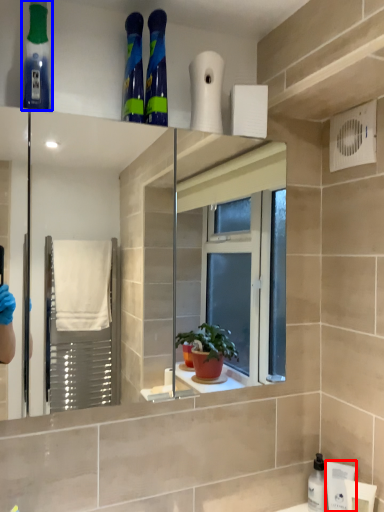
Question: Which object appears farthest to the camera in this image, toiletry (highlighted by a red box) or mouthwash (highlighted by a blue box)?

Choices:
 (A) toiletry
 (B) mouthwash

Answer: (A)